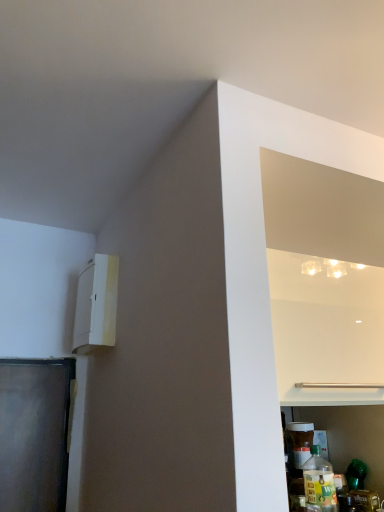
What do you see at coordinates (349, 436) in the screenshot? The image size is (384, 512). I see `translucent plastic bottles at lower right` at bounding box center [349, 436].

You are a GUI agent. You are given a task and a screenshot of the screen. Output one action in this format:
    pyautogui.click(x=<x>, y=<y>)
    Task: Click on the translucent plastic bottles at lower right
    This screenshot has width=384, height=512.
    Given the screenshot: What is the action you would take?
    pyautogui.click(x=349, y=436)

Locate an element on the screen. translucent plastic bottles at lower right is located at coordinates (349, 436).